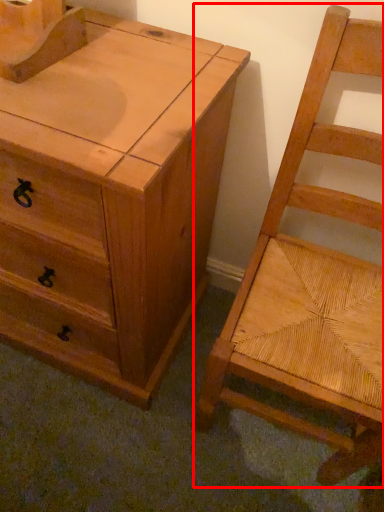
Question: Considering the relative positions of chair (annotated by the red box) and chest of drawers in the image provided, where is chair (annotated by the red box) located with respect to the staircase?

Choices:
 (A) left
 (B) right

Answer: (B)